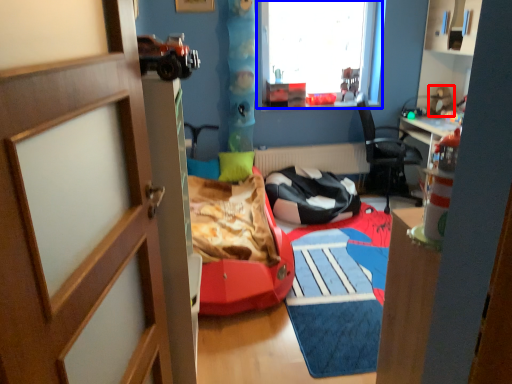
Question: Which of the following is the farthest to the observer, toy (highlighted by a red box) or window (highlighted by a blue box)?

Choices:
 (A) toy
 (B) window

Answer: (A)